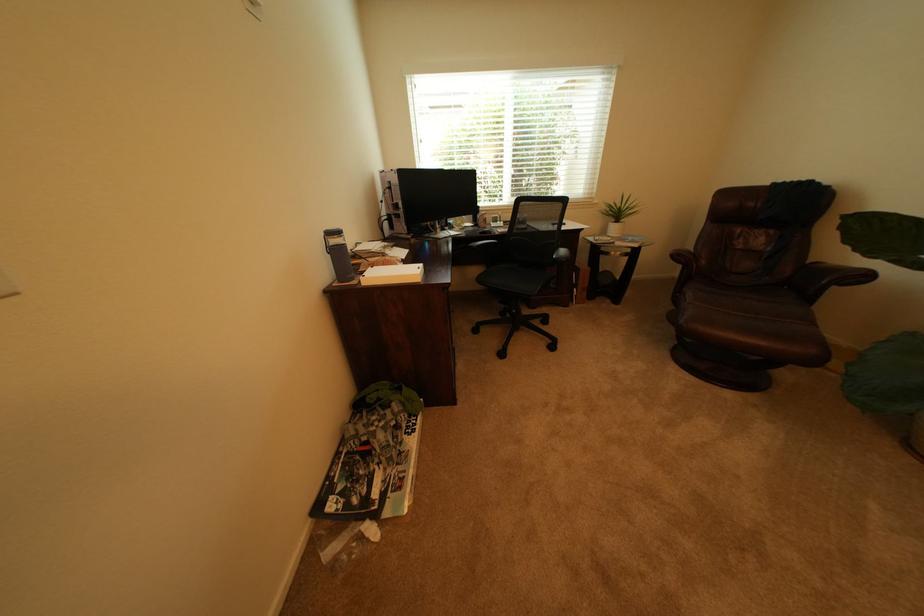
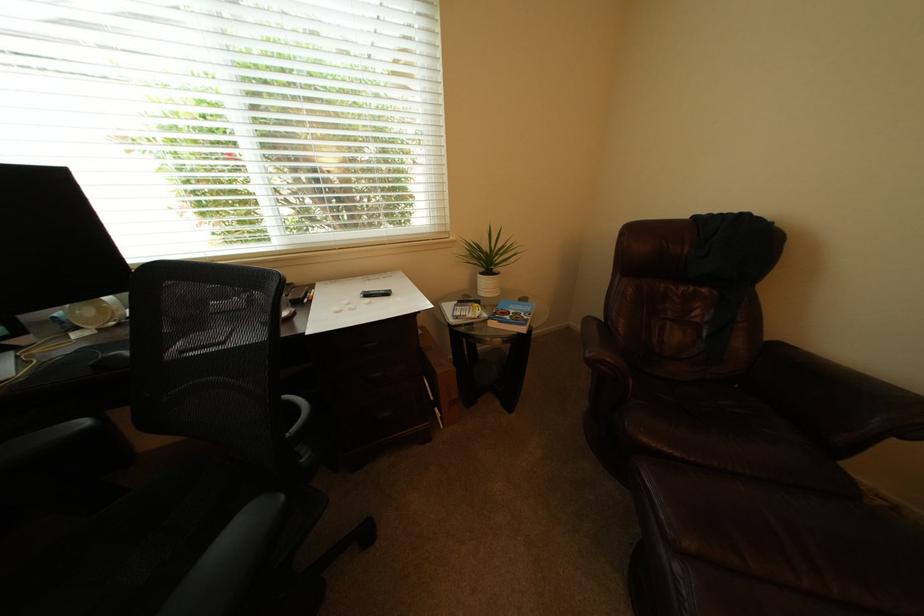
Find the pixel in the second image that matches point 606,206 in the first image.

(466, 243)